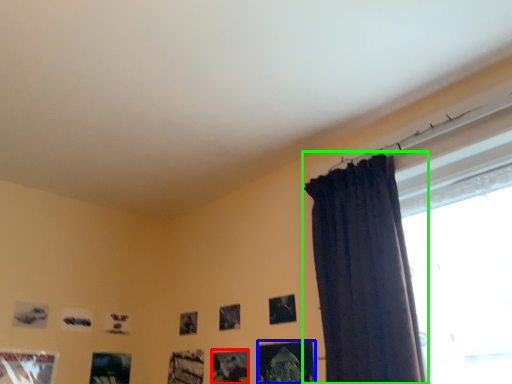
Question: Estimate the real-world distances between objects in this image. Which object is closer to picture frame (highlighted by a red box), picture frame (highlighted by a blue box) or curtain (highlighted by a green box)?

Choices:
 (A) picture frame
 (B) curtain

Answer: (A)